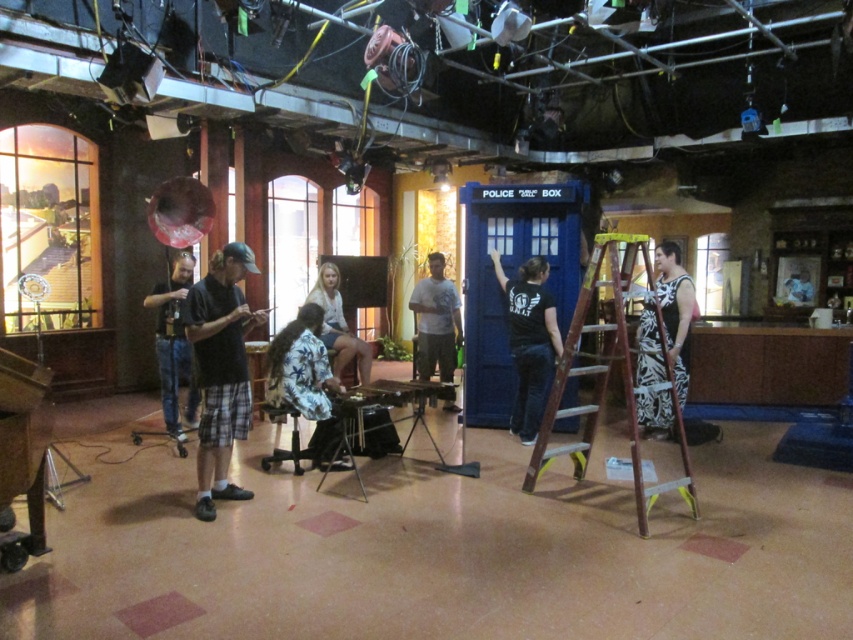
You are an assistant on a movie set and need to place two markers at the coordinates point (x=230, y=435) and point (x=296, y=337). Which marker should you place first if you want to start with the one closer to you?

You should place the marker at point (x=230, y=435) first because it is closer to the viewer than point (x=296, y=337).

You are a costume designer working on a period drama. You need to ensure that the black plaid shorts at center and the floral shirt at center are positioned correctly for the scene. What is the minimum distance you should maintain between these two items to ensure they don not overlap in the final shot?

The minimum distance you should maintain between the black plaid shorts at center and the floral shirt at center is 65.86 centimeters to prevent overlapping in the final shot.